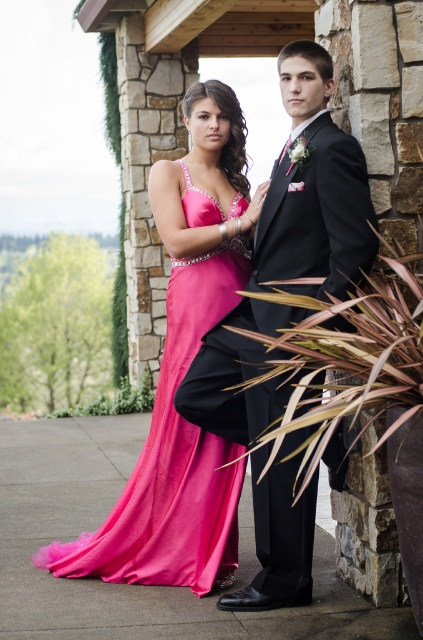
Which is behind, point (331, 188) or point (203, 490)?

The point (203, 490) is more distant.

Does shiny black suit at center have a lesser width compared to shiny satin gown at center?

Indeed, shiny black suit at center has a lesser width compared to shiny satin gown at center.

Is point (315, 493) closer to viewer compared to point (227, 512)?

Yes.

I want to click on shiny black suit at center, so click(313, 189).